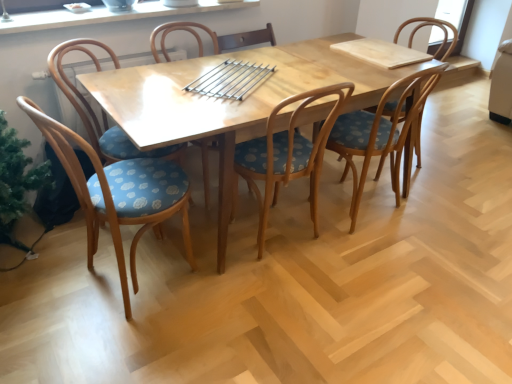
Locate an element on the screen. Image resolution: width=512 pixels, height=384 pixels. free space below blue polka dot wood chair at left, which is the 2th chair from left to right (from a real-world perspective) is located at coordinates (119, 291).